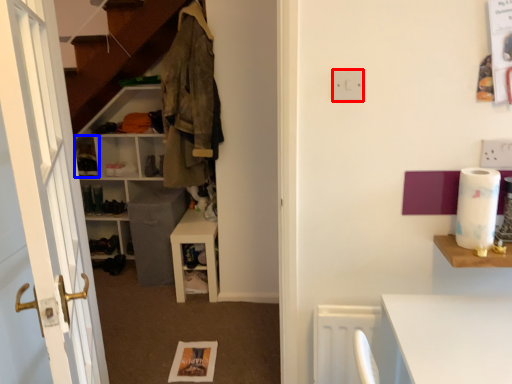
Question: Which of the following is the farthest to the observer, electric outlet (highlighted by a red box) or cabinet (highlighted by a blue box)?

Choices:
 (A) electric outlet
 (B) cabinet

Answer: (B)